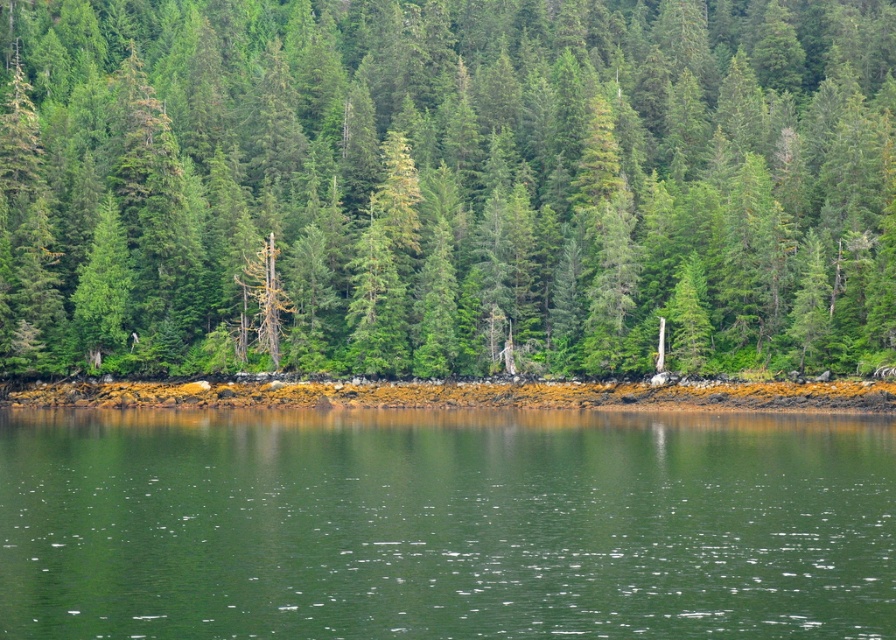
Between point (864, 88) and point (614, 381), which one is positioned behind?

The point (864, 88) is more distant.

Which is below, green matte tree at center or brown mossy rocks at lower center?

brown mossy rocks at lower center is below.

Where is `green matte tree at center`? The width and height of the screenshot is (896, 640). green matte tree at center is located at coordinates (446, 184).

Does green matte tree at center lie in front of green smooth water at center?

No, green matte tree at center is further to the viewer.

What do you see at coordinates (446, 184) in the screenshot? The height and width of the screenshot is (640, 896). I see `green matte tree at center` at bounding box center [446, 184].

I want to click on green matte tree at center, so click(446, 184).

The width and height of the screenshot is (896, 640). What are the coordinates of `green matte tree at center` in the screenshot? It's located at (446, 184).

Is green smooth water at center shorter than brown mossy rocks at lower center?

Yes, green smooth water at center is shorter than brown mossy rocks at lower center.

In the scene shown: Which is below, green smooth water at center or brown mossy rocks at lower center?

Positioned lower is green smooth water at center.

This screenshot has width=896, height=640. In order to click on green smooth water at center in this screenshot , I will do `click(444, 524)`.